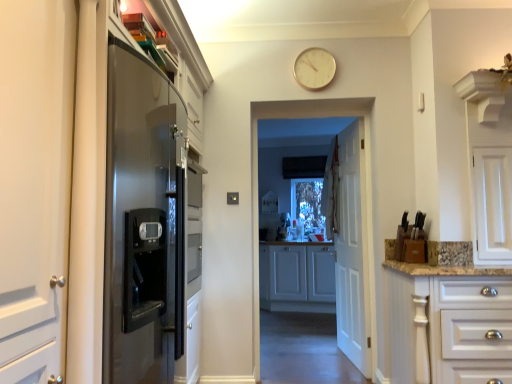
Locate an element on the screen. The image size is (512, 384). gold metallic clock at upper center is located at coordinates pos(314,68).

Locate an element on the screen. The width and height of the screenshot is (512, 384). white glossy cabinet at right, which appears as the first cabinetry when viewed from the front is located at coordinates (446, 323).

Where is `white wooden door at center`? white wooden door at center is located at coordinates (351, 248).

The height and width of the screenshot is (384, 512). Identify the location of white matte cabinet at center, the second cabinetry from the front. (297, 278).

Does gold metallic clock at upper center turn towards white glossy cabinets at center?

No, gold metallic clock at upper center is not turned towards white glossy cabinets at center.

Is point (308, 62) positioned after point (292, 308)?

No.

Based on the photo, can you tell me how much gold metallic clock at upper center and white glossy cabinets at center differ in facing direction?

gold metallic clock at upper center and white glossy cabinets at center are facing 180 degrees away from each other.

Considering the relative sizes of gold metallic clock at upper center and white glossy cabinets at center in the image provided, is gold metallic clock at upper center thinner than white glossy cabinets at center?

Correct, the width of gold metallic clock at upper center is less than that of white glossy cabinets at center.

Locate an element on the screen. corridor above the white glossy cabinet at right, acting as the 2th cabinetry starting from the back (from the image's perspective) is located at coordinates (316, 233).

Who is more distant, white glossy cabinets at center or white glossy cabinet at right, acting as the 2th cabinetry starting from the back?

white glossy cabinets at center is further away from the camera.

Which is in front, point (354, 348) or point (503, 379)?

The point (503, 379) is closer.

What's the angular difference between white glossy cabinets at center and white glossy cabinet at right, acting as the 2th cabinetry starting from the back,'s facing directions?

The facing directions of white glossy cabinets at center and white glossy cabinet at right, acting as the 2th cabinetry starting from the back, are 180 degrees apart.

Is the depth of white glossy cabinet at right, which appears as the first cabinetry when viewed from the front, greater than that of gold metallic clock at upper center?

No, white glossy cabinet at right, which appears as the first cabinetry when viewed from the front, is closer to the camera.

Is white glossy cabinet at right, which appears as the first cabinetry when viewed from the front, shorter than gold metallic clock at upper center?

Incorrect, the height of white glossy cabinet at right, which appears as the first cabinetry when viewed from the front, does not fall short of that of gold metallic clock at upper center.

From a real-world perspective, which object rests below the other?

From a 3D spatial view, white glossy cabinet at right, which appears as the first cabinetry when viewed from the front, is below.

Is white glossy cabinet at right, which appears as the first cabinetry when viewed from the front, at the left side of gold metallic clock at upper center?

Incorrect, white glossy cabinet at right, which appears as the first cabinetry when viewed from the front, is not on the left side of gold metallic clock at upper center.

Between white wooden door at center and white glossy cabinet at right, acting as the 2th cabinetry starting from the back, which one has less height?

Standing shorter between the two is white glossy cabinet at right, acting as the 2th cabinetry starting from the back.

Is white wooden door at center not within white glossy cabinet at right, which appears as the first cabinetry when viewed from the front?

That's correct, white wooden door at center is outside of white glossy cabinet at right, which appears as the first cabinetry when viewed from the front.

Looking at the image, does white wooden door at center seem bigger or smaller compared to white glossy cabinet at right, acting as the 2th cabinetry starting from the back?

white wooden door at center is smaller than white glossy cabinet at right, acting as the 2th cabinetry starting from the back.

Considering the sizes of white glossy cabinet at right, which appears as the first cabinetry when viewed from the front, and white wooden door at center in the image, is white glossy cabinet at right, which appears as the first cabinetry when viewed from the front, taller or shorter than white wooden door at center?

Clearly, white glossy cabinet at right, which appears as the first cabinetry when viewed from the front, is shorter compared to white wooden door at center.

Based on the photo, is white glossy cabinet at right, acting as the 2th cabinetry starting from the back, looking in the opposite direction of white wooden door at center?

Yes, white glossy cabinet at right, acting as the 2th cabinetry starting from the back,'s orientation is away from white wooden door at center.

Is the depth of white glossy cabinet at right, which appears as the first cabinetry when viewed from the front, greater than that of white wooden door at center?

No, white glossy cabinet at right, which appears as the first cabinetry when viewed from the front, is in front of white wooden door at center.

Is white glossy cabinet at right, acting as the 2th cabinetry starting from the back, to the left or to the right of white wooden door at center in the image?

From the image, it's evident that white glossy cabinet at right, acting as the 2th cabinetry starting from the back, is to the right of white wooden door at center.

This screenshot has width=512, height=384. Find the location of `door below the white glossy cabinets at center (from the image's perspective)`. door below the white glossy cabinets at center (from the image's perspective) is located at coordinates (351, 248).

Which object is closer to the camera, white wooden door at center or white glossy cabinets at center?

white glossy cabinets at center is closer to the camera.

From a real-world perspective, is white wooden door at center above or below white glossy cabinets at center?

In terms of real-world spatial position, white wooden door at center is below white glossy cabinets at center.

Is white wooden door at center turned away from white glossy cabinets at center?

No.

The image size is (512, 384). Find the location of `cabinetry that is the 2nd object directly below the gold metallic clock at upper center (from a real-world perspective)`. cabinetry that is the 2nd object directly below the gold metallic clock at upper center (from a real-world perspective) is located at coordinates (297, 278).

Does white matte cabinet at center, the second cabinetry from the front, have a greater height compared to gold metallic clock at upper center?

Indeed, white matte cabinet at center, the second cabinetry from the front, has a greater height compared to gold metallic clock at upper center.

Is point (291, 262) closer or farther from the camera than point (326, 66)?

Clearly, point (291, 262) is more distant from the camera than point (326, 66).

Which is correct: white matte cabinet at center, the second cabinetry from the front, is inside gold metallic clock at upper center, or outside of it?

white matte cabinet at center, the second cabinetry from the front, is outside gold metallic clock at upper center.

Locate an element on the screen. The height and width of the screenshot is (384, 512). clock on the left of white glossy cabinets at center is located at coordinates (314, 68).

Locate an element on the screen. The width and height of the screenshot is (512, 384). corridor above the white glossy cabinet at right, acting as the 2th cabinetry starting from the back (from a real-world perspective) is located at coordinates (316, 233).

Which object lies nearer to the anchor point white wooden door at center, white matte cabinet at center, the 1th cabinetry viewed from the back, or gold metallic clock at upper center?

gold metallic clock at upper center is closer to white wooden door at center.

Based on their spatial positions, is gold metallic clock at upper center or white wooden door at center further from white matte cabinet at center, the second cabinetry from the front?

gold metallic clock at upper center is further to white matte cabinet at center, the second cabinetry from the front.

From the image, which object appears to be nearer to white glossy cabinet at right, which appears as the first cabinetry when viewed from the front, white matte cabinet at center, the 1th cabinetry viewed from the back, or white glossy cabinets at center?

Based on the image, white glossy cabinets at center appears to be nearer to white glossy cabinet at right, which appears as the first cabinetry when viewed from the front.

Based on their spatial positions, is gold metallic clock at upper center or white glossy cabinet at right, acting as the 2th cabinetry starting from the back, closer to white wooden door at center?

white glossy cabinet at right, acting as the 2th cabinetry starting from the back, is closer to white wooden door at center.

Considering their positions, is white matte cabinet at center, the 1th cabinetry viewed from the back, positioned closer to white wooden door at center than white glossy cabinets at center?

Among the two, white matte cabinet at center, the 1th cabinetry viewed from the back, is located nearer to white wooden door at center.

In the scene shown: Looking at the image, which one is located further to white matte cabinet at center, the second cabinetry from the front, gold metallic clock at upper center or white glossy cabinets at center?

gold metallic clock at upper center is further to white matte cabinet at center, the second cabinetry from the front.

Looking at the image, which one is located further to white glossy cabinet at right, which appears as the first cabinetry when viewed from the front, white glossy cabinets at center or white matte cabinet at center, the second cabinetry from the front?

The object further to white glossy cabinet at right, which appears as the first cabinetry when viewed from the front, is white matte cabinet at center, the second cabinetry from the front.

Estimate the real-world distances between objects in this image. Which object is further from white glossy cabinet at right, which appears as the first cabinetry when viewed from the front, gold metallic clock at upper center or white wooden door at center?

gold metallic clock at upper center lies further to white glossy cabinet at right, which appears as the first cabinetry when viewed from the front, than the other object.

Find the location of `door between white glossy cabinets at center and white matte cabinet at center, the second cabinetry from the front, from front to back`. door between white glossy cabinets at center and white matte cabinet at center, the second cabinetry from the front, from front to back is located at coordinates (351, 248).

Locate an element on the screen. Image resolution: width=512 pixels, height=384 pixels. corridor between white glossy cabinet at right, acting as the 2th cabinetry starting from the back, and white wooden door at center from front to back is located at coordinates (316, 233).

Locate an element on the screen. The image size is (512, 384). corridor between gold metallic clock at upper center and white matte cabinet at center, the second cabinetry from the front, from front to back is located at coordinates (316, 233).

This screenshot has width=512, height=384. In order to click on corridor between gold metallic clock at upper center and white wooden door at center in the up-down direction in this screenshot , I will do `click(316, 233)`.